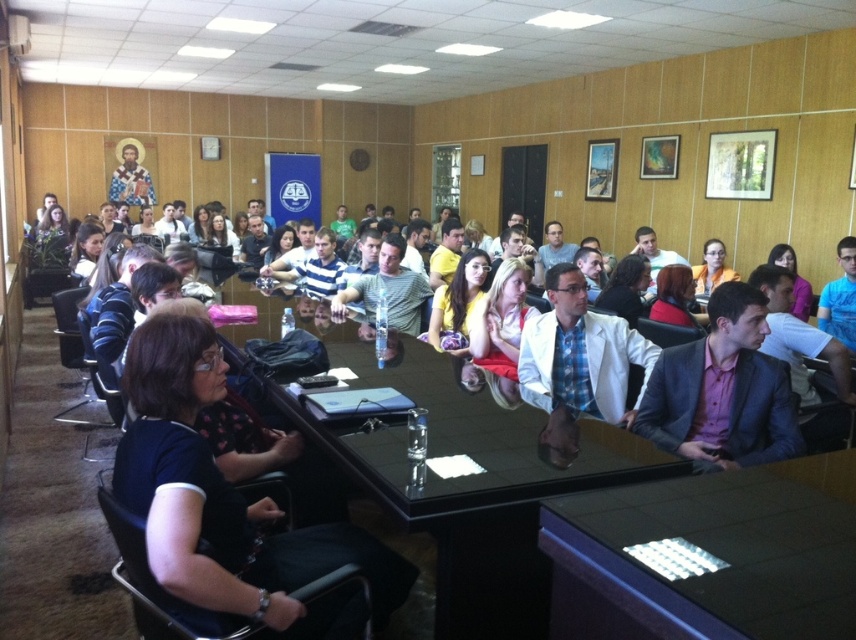
Question: Among these objects, which one is nearest to the camera?

Choices:
 (A) dark blue fabric shirt at lower left
 (B) pink fabric shirt at center
 (C) black glossy table at lower right

Answer: (C)

Question: Is white matte blazer at center in front of yellow fabric dress at center?

Choices:
 (A) yes
 (B) no

Answer: (A)

Question: Among these points, which one is farthest from the camera?

Choices:
 (A) (626, 413)
 (B) (146, 413)
 (C) (382, 273)
 (D) (782, 436)

Answer: (C)

Question: Does black glossy table at center appear under white matte blazer at center?

Choices:
 (A) yes
 (B) no

Answer: (A)

Question: Considering the relative positions of black glossy table at lower right and white matte blazer at center in the image provided, where is black glossy table at lower right located with respect to white matte blazer at center?

Choices:
 (A) above
 (B) below

Answer: (B)

Question: Which object is positioned farthest from the dark blue fabric shirt at lower left?

Choices:
 (A) black glossy table at center
 (B) white matte blazer at center

Answer: (B)